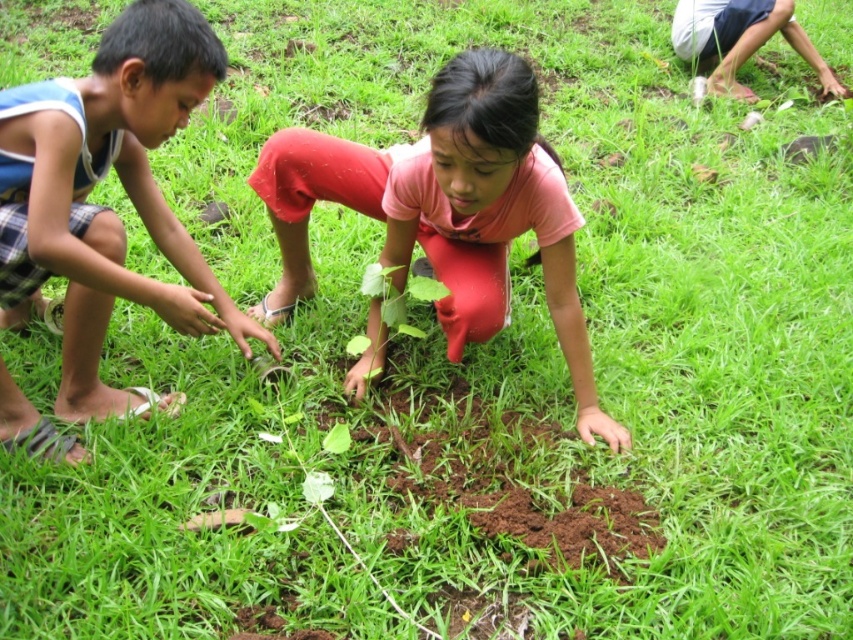
Is point (180, 106) less distant than point (477, 204)?

Yes, point (180, 106) is in front of point (477, 204).

Measure the distance between blue plaid shorts at left and camera.

They are 6.51 feet apart.

Find the location of a particular element. blue plaid shorts at left is located at coordinates (105, 205).